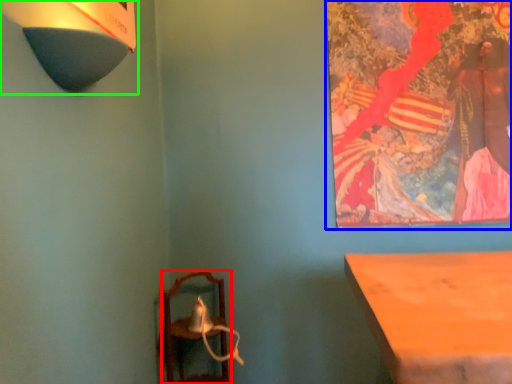
Question: Which object is the farthest from furniture (highlighted by a red box)? Choose among these: picture frame (highlighted by a blue box) or lamp (highlighted by a green box).

Choices:
 (A) picture frame
 (B) lamp

Answer: (B)